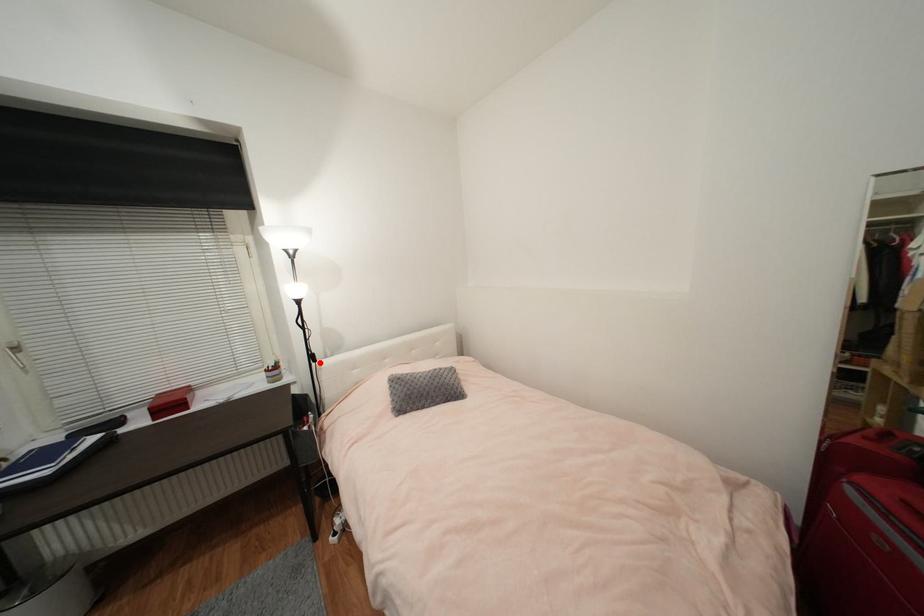
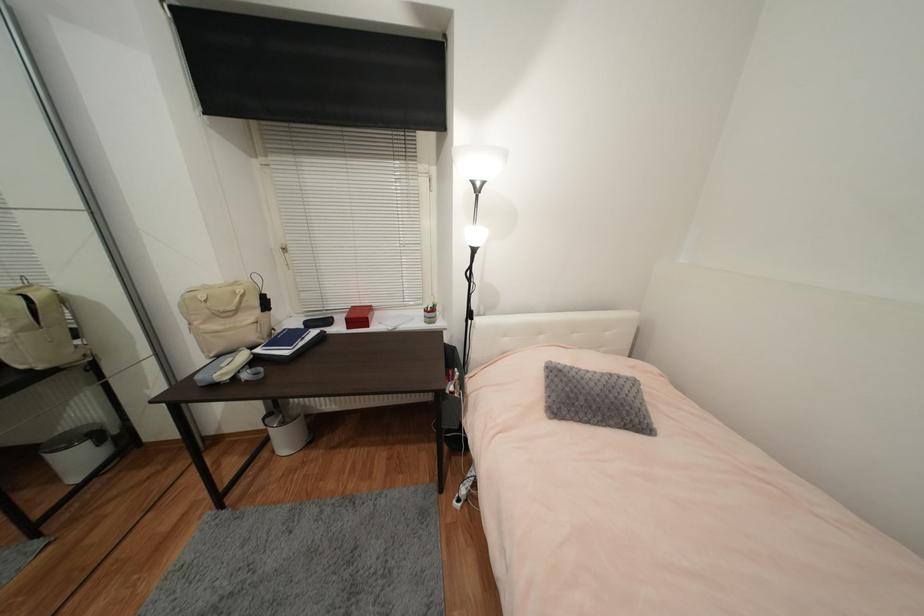
Locate, in the second image, the point that corresponds to the highlighted location in the first image.

(477, 320)